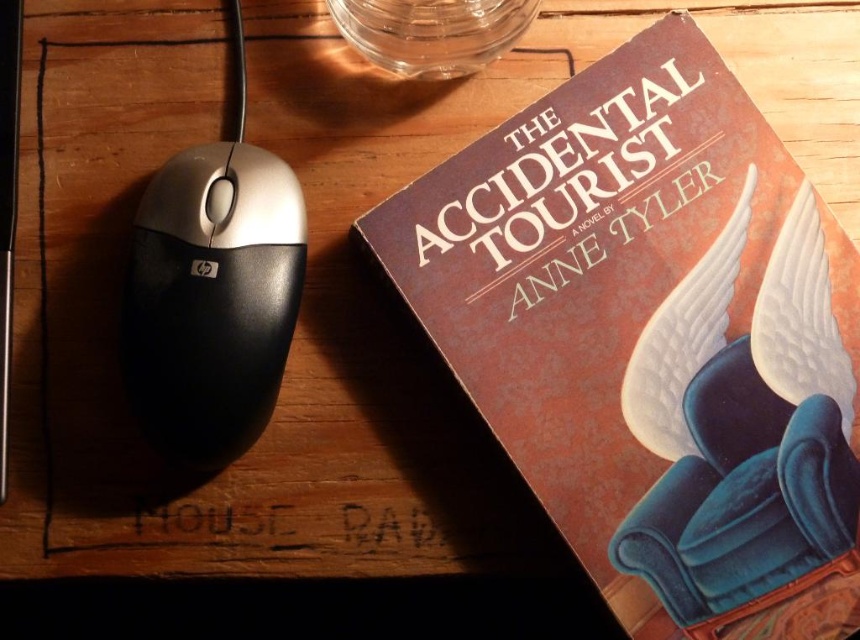
Consider the image. You are looking at the desk with the book and computer mouse. There are two points marked on the desk surface. The first point is at coordinates point (507, 413) and the second is at point (259, 358). From your perspective, which point is closer to you?

Point (259, 358) is closer to you because point (507, 413) is behind it.

You are organizing items on your desk and need to place a new item at coordinates that are directly to the right of the matte brown paper at upper right. What is the approximate coordinate for this new placement?

The matte brown paper at upper right is located at point (x=630, y=291). To place an item directly to the right, you would adjust the x coordinate slightly higher while keeping the y coordinate the same. The new coordinate would be approximately (x=630, y=298).

You are organizing items on your desk and want to place a new notebook between the matte brown paper at upper right and the black plastic mouse at left. Based on their positions, which item is closer to you, and will the notebook fit between them if it requires 10 cm of space?

The matte brown paper at upper right is closer to you than the black plastic mouse at left. Since the notebook requires 10 cm of space, you need to check the distance between them. However, the description only states their relative depth, not the horizontal distance. You might need to measure the space between them to ensure it accommodates the notebook.